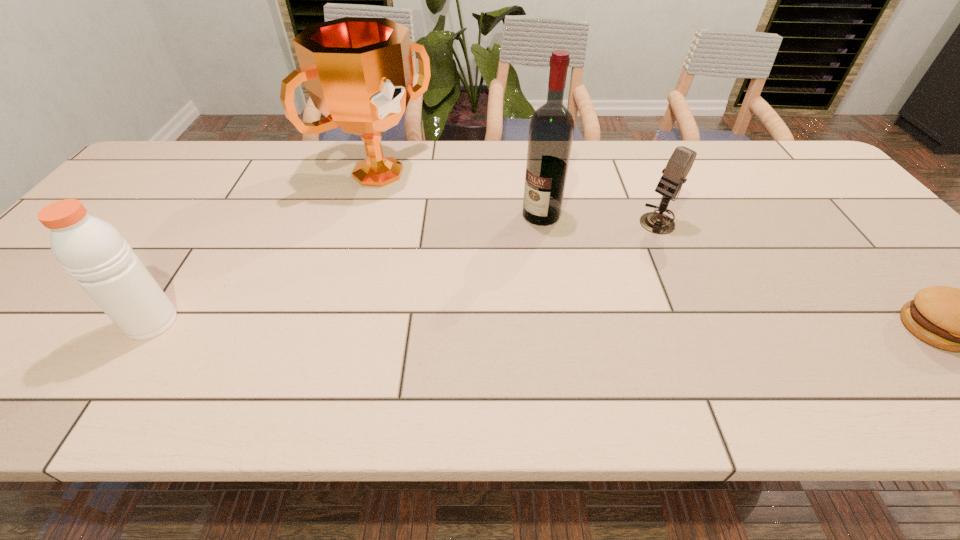
The image size is (960, 540). In the image, there is a desktop. In order to click on blank space at the right edge in this screenshot , I will do `click(864, 236)`.

This screenshot has height=540, width=960. In order to click on unoccupied area between the third object from right to left and the leftmost object in this screenshot , I will do `click(347, 268)`.

The width and height of the screenshot is (960, 540). Identify the location of vacant area that lies between the third object from right to left and the fourth object from right to left. (460, 194).

This screenshot has width=960, height=540. I want to click on vacant area between the second object from right to left and the farthest object, so click(517, 196).

Where is `free space between the farthest object and the second object from right to left`? The width and height of the screenshot is (960, 540). free space between the farthest object and the second object from right to left is located at coordinates (517, 196).

The height and width of the screenshot is (540, 960). I want to click on free space between the farthest object and the leftmost object, so click(265, 248).

Select which object is the third closest to the farthest object. Please provide its 2D coordinates. Your answer should be formatted as a tuple, i.e. [(x, y)], where the tuple contains the x and y coordinates of a point satisfying the conditions above.

[(680, 163)]

Identify the location of object that is the third nearest to the third shortest object. The image size is (960, 540). (680, 163).

At what (x,y) coordinates should I click in order to perform the action: click on vacant point that satisfies the following two spatial constraints: 1. on the back side of the third tallest object; 2. on the right side of the award. Please return your answer as a coordinate pair (x, y). The image size is (960, 540). Looking at the image, I should click on (250, 173).

The height and width of the screenshot is (540, 960). Identify the location of vacant space that satisfies the following two spatial constraints: 1. on the back side of the leftmost object; 2. on the left side of the third object from left to right. (223, 215).